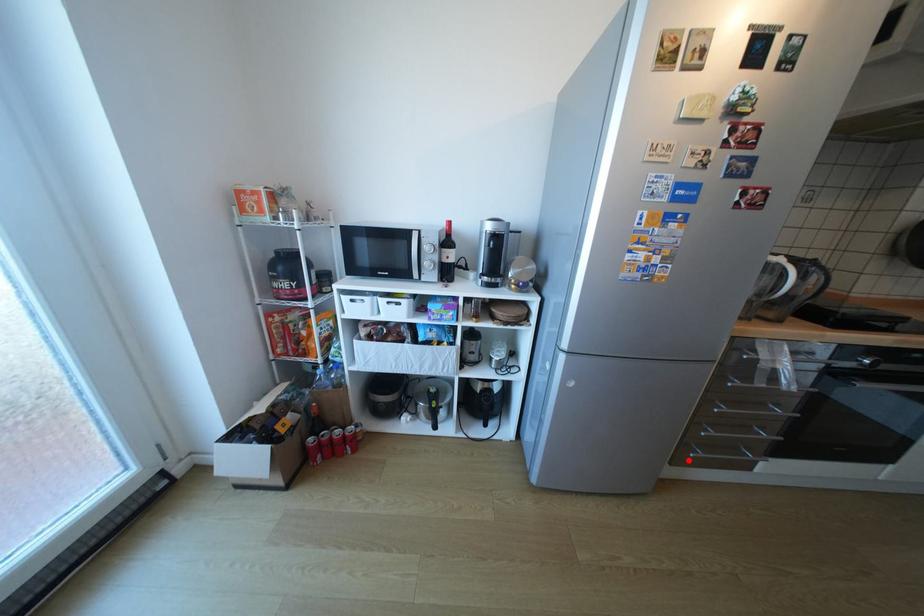
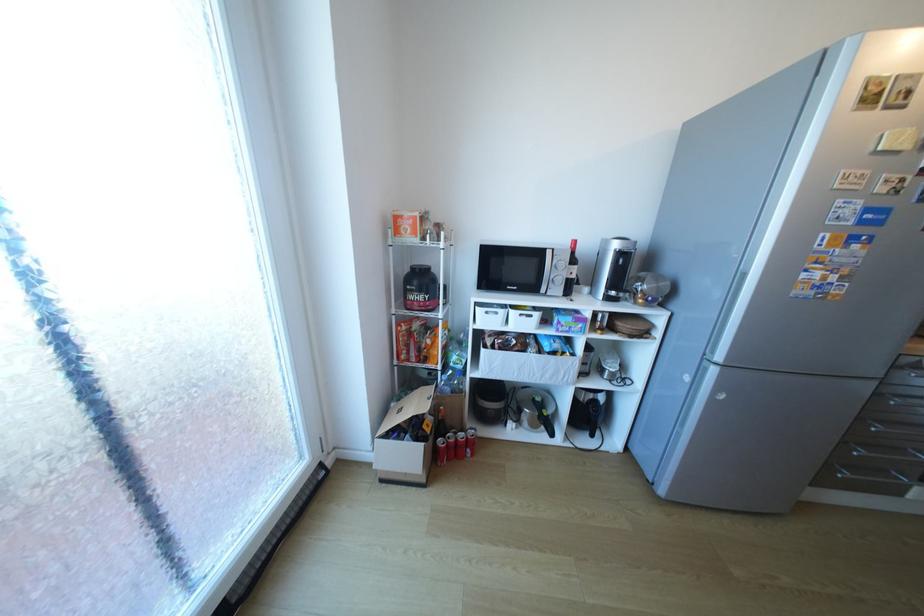
Question: I am providing you with two images of the same scene from different viewpoints. In image1, a red point is highlighted. Considering the same 3D point in image2, which of the following is correct?

Choices:
 (A) It is closer
 (B) It is farther

Answer: (A)